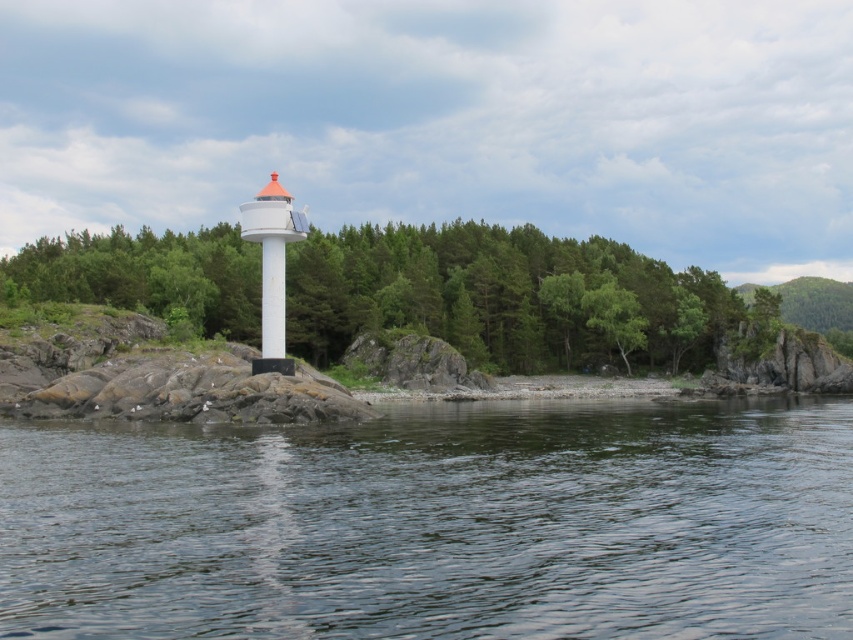
You are a bird flying over the coastal area. You see the transparent water at center and the green matte tree at center. Which one is closer to the ground?

The transparent water at center is located below the green matte tree at center, so it is closer to the ground.

You are standing on the rocky outcrop near the lighthouse and want to walk towards the green leafy tree at center. Which direction should you move relative to the transparent water at center?

You should move to the right of the transparent water at center because the green leafy tree at center is to the right of the transparent water at center.

You are a hiker trying to navigate through the forest behind the lighthouse. You notice two trees at the center of your view, a green matte tree at center and a green leafy tree at center. Which tree would you choose to use for shade if you want the larger one?

The green matte tree at center is larger in size than the green leafy tree at center, so you should choose the green matte tree at center for shade.